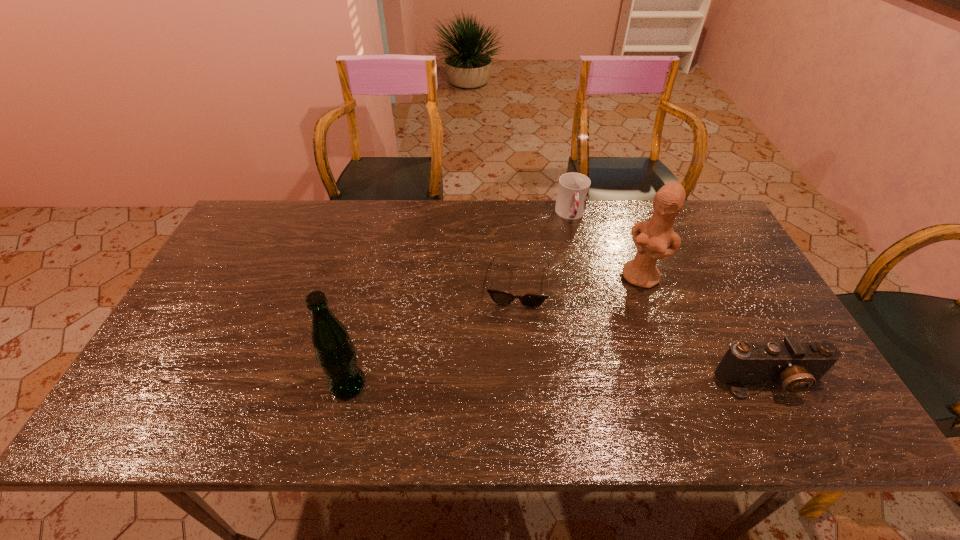
Locate an element on the screen. object at the right edge is located at coordinates (798, 366).

The width and height of the screenshot is (960, 540). What are the coordinates of `object positioned at the near right corner` in the screenshot? It's located at (798, 366).

Where is `free region at the far edge of the desktop`? free region at the far edge of the desktop is located at coordinates (468, 202).

The height and width of the screenshot is (540, 960). I want to click on vacant space at the left edge of the desktop, so click(246, 247).

Find the location of `blank space at the right edge`. blank space at the right edge is located at coordinates (734, 339).

The height and width of the screenshot is (540, 960). In the image, there is a desktop. In order to click on vacant region at the far left corner in this screenshot , I will do `click(276, 214)`.

Find the location of `free space at the near left corner`. free space at the near left corner is located at coordinates (143, 379).

At what (x,y) coordinates should I click in order to perform the action: click on free space between the rightmost object and the figurine. Please return your answer as a coordinate pair (x, y). Image resolution: width=960 pixels, height=540 pixels. Looking at the image, I should click on (706, 329).

You are a GUI agent. You are given a task and a screenshot of the screen. Output one action in this format:
    pyautogui.click(x=<x>, y=<y>)
    Task: Click on the vacant area that lies between the leftmost object and the second object from left to right
    
    Given the screenshot: What is the action you would take?
    pyautogui.click(x=433, y=335)

Locate an element on the screen. This screenshot has height=540, width=960. vacant space that's between the farthest object and the rightmost object is located at coordinates (670, 298).